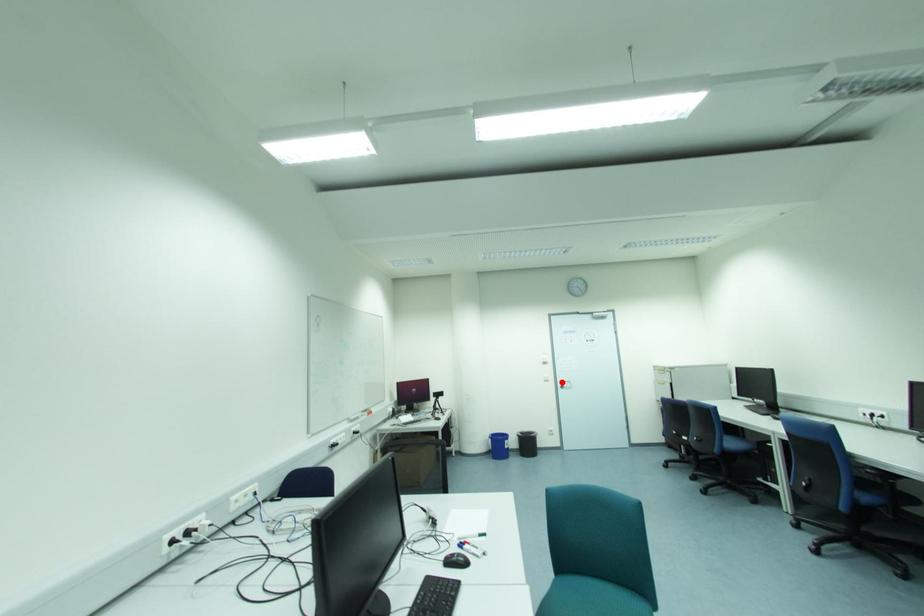
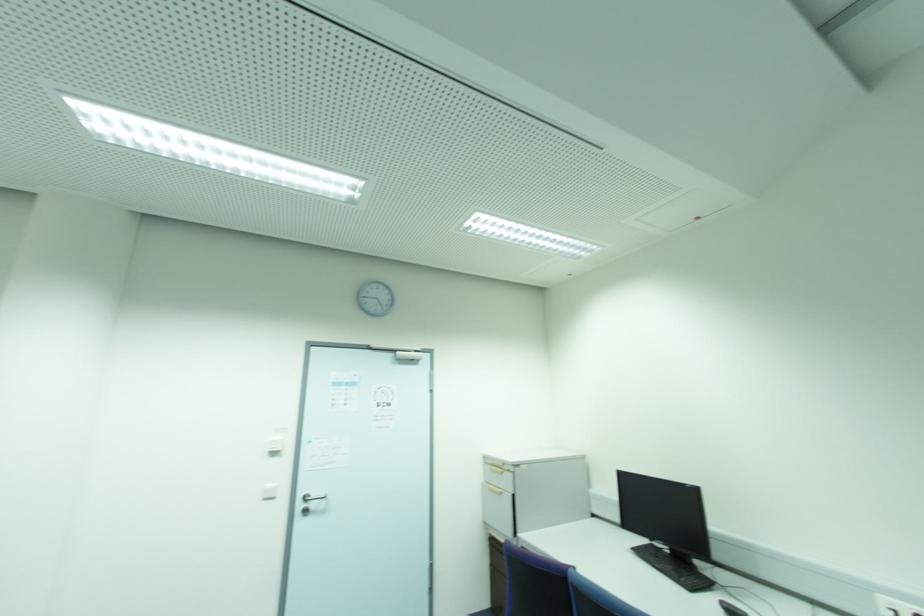
Question: I am providing you with two images of the same scene from different viewpoints. Given a red point in image1, look at the same physical point in image2. Is it:

Choices:
 (A) Closer to the viewpoint
 (B) Farther from the viewpoint

Answer: (A)